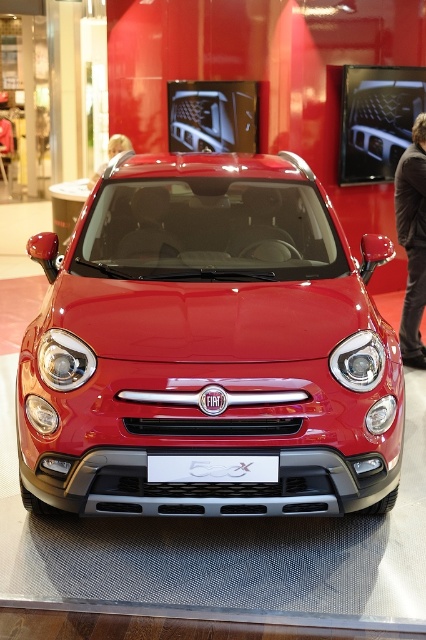
Question: In this image, where is dark brown leather jacket at right located relative to matte red car at upper left?

Choices:
 (A) right
 (B) left

Answer: (A)

Question: Which point is farther to the camera?

Choices:
 (A) (310, 406)
 (B) (261, 480)
 (C) (95, 177)

Answer: (C)

Question: Which point is farther to the camera?

Choices:
 (A) dark brown leather jacket at right
 (B) glossy red car at center
 (C) matte red car at upper left

Answer: (C)

Question: Does glossy red car at center have a greater width compared to white plastic license plate at center?

Choices:
 (A) yes
 (B) no

Answer: (A)

Question: Among these points, which one is nearest to the camera?

Choices:
 (A) (108, 269)
 (B) (256, 460)
 (C) (118, 141)

Answer: (B)

Question: Is glossy red car at center positioned behind dark brown leather jacket at right?

Choices:
 (A) yes
 (B) no

Answer: (B)